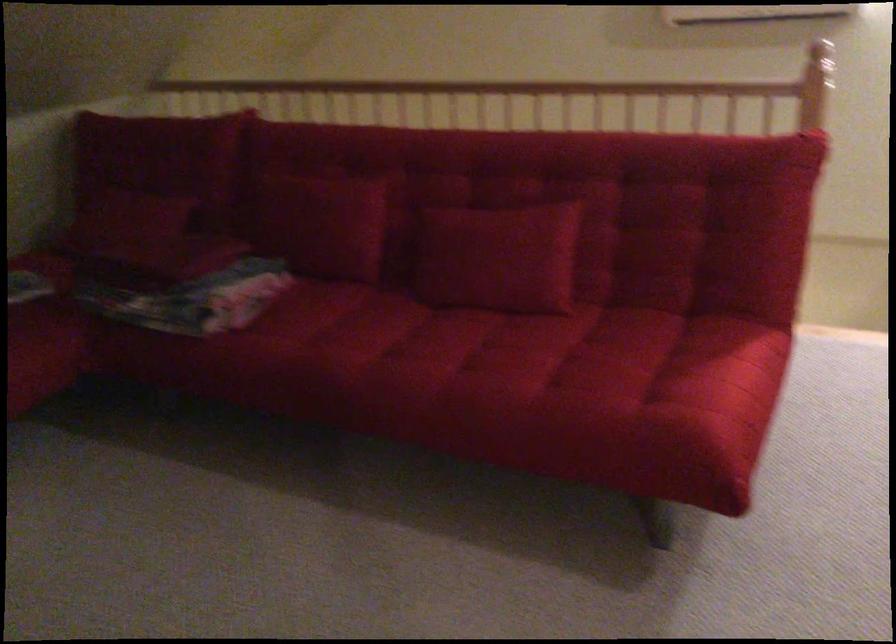
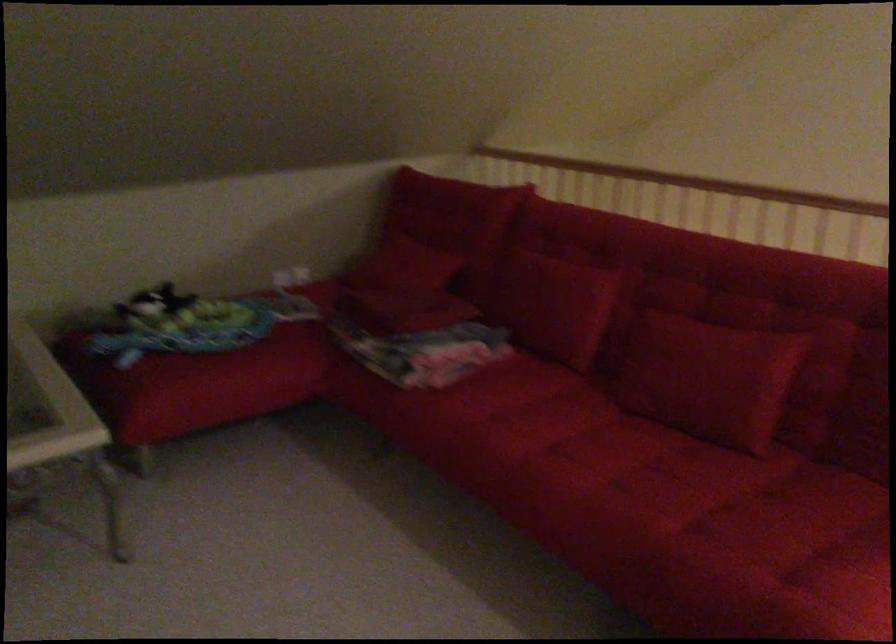
In the second image, find the point that corresponds to (x=331, y=228) in the first image.

(555, 306)